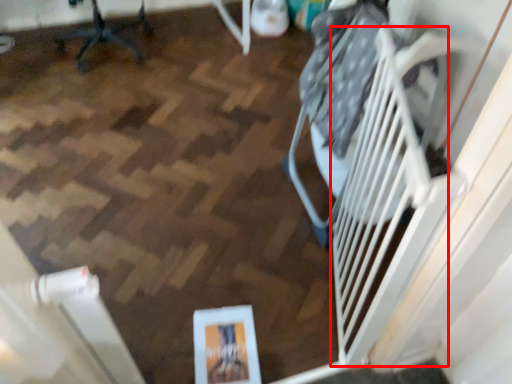
Question: From the image's perspective, what is the correct spatial relationship of stairs (annotated by the red box) in relation to furniture?

Choices:
 (A) below
 (B) above

Answer: (A)